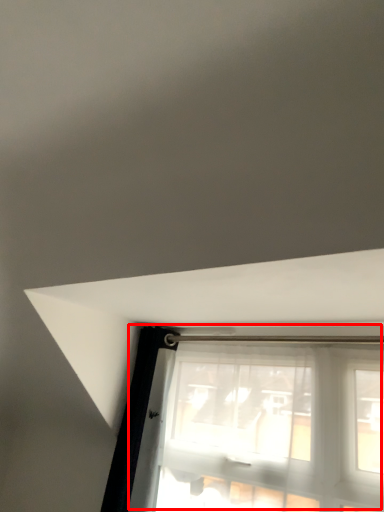
Question: From the image's perspective, considering the relative positions of window (annotated by the red box) and beam in the image provided, where is window (annotated by the red box) located with respect to the staircase?

Choices:
 (A) above
 (B) below

Answer: (B)